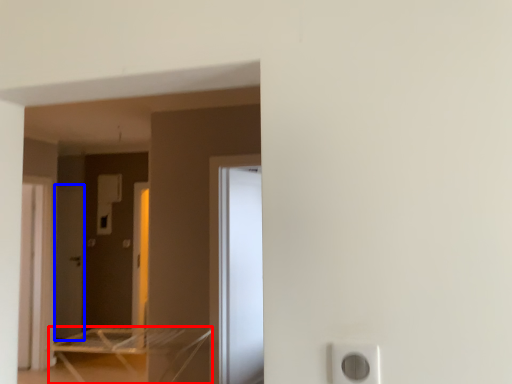
Question: Which object is further to the camera taking this photo, furniture (highlighted by a red box) or screen door (highlighted by a blue box)?

Choices:
 (A) furniture
 (B) screen door

Answer: (B)